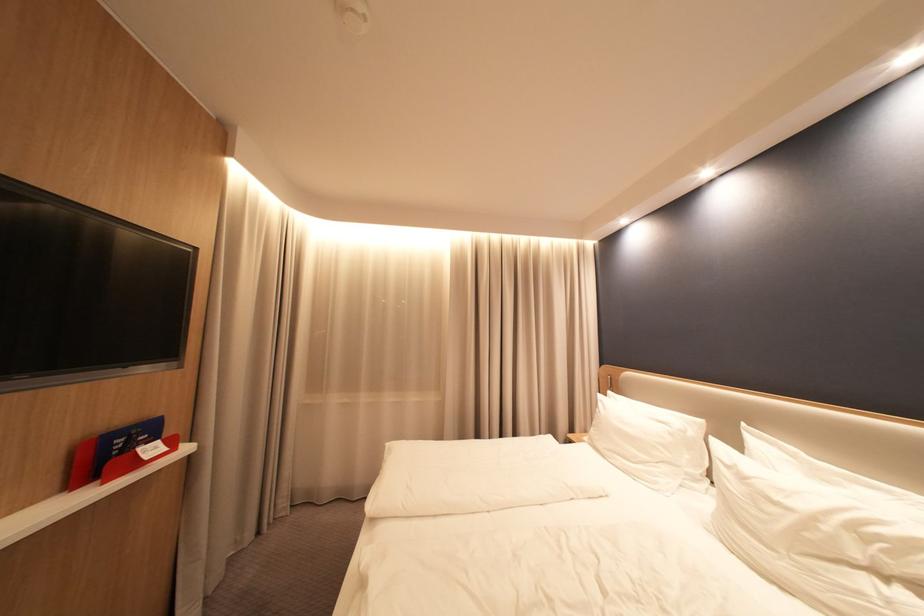
Where is `curtain edge`? The height and width of the screenshot is (616, 924). curtain edge is located at coordinates (233, 387).